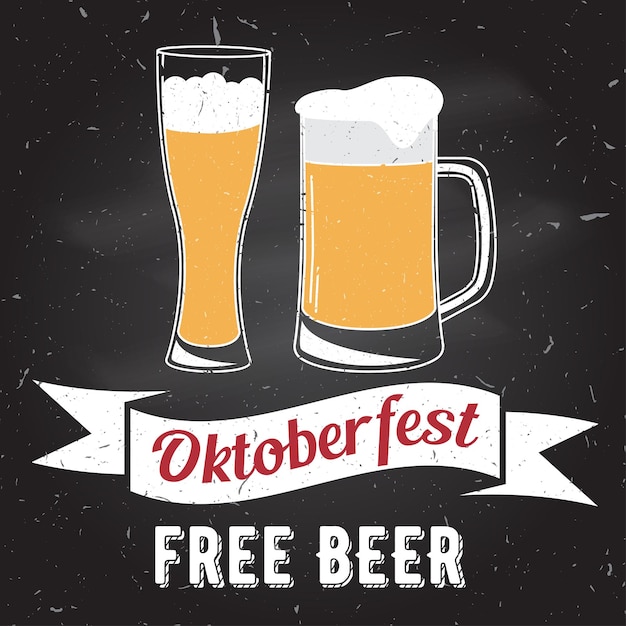
Where is `larger beer glass`? This screenshot has height=626, width=626. larger beer glass is located at coordinates (207, 197).